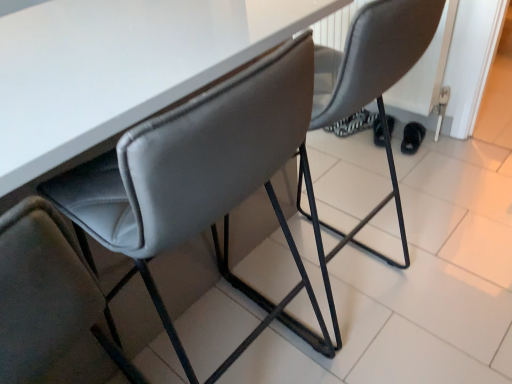
Where is `suede-like gray chair at center, which ranks as the 2th chair in right-to-left order`? suede-like gray chair at center, which ranks as the 2th chair in right-to-left order is located at coordinates (203, 182).

Between suede-like gray chair at center, which ranks as the 2th chair in right-to-left order, and black fuzzy slipper at lower right, which one has smaller size?

black fuzzy slipper at lower right is smaller.

Is suede-like gray chair at center, the 1th chair from the left, surrounding black fuzzy slipper at lower right?

No, black fuzzy slipper at lower right is located outside of suede-like gray chair at center, the 1th chair from the left.

From the image's perspective, is suede-like gray chair at center, the 1th chair from the left, on top of black fuzzy slipper at lower right?

Actually, suede-like gray chair at center, the 1th chair from the left, appears below black fuzzy slipper at lower right in the image.

Which is in front, suede-like gray chair at center, the 1th chair from the left, or black fuzzy slipper at lower right?

Positioned in front is suede-like gray chair at center, the 1th chair from the left.

From the image's perspective, is suede-like gray chair at center, which ranks as the 2th chair in right-to-left order, over matte gray chair at center, the 2th chair viewed from the left?

Indeed, from the image's perspective, suede-like gray chair at center, which ranks as the 2th chair in right-to-left order, is shown above matte gray chair at center, the 2th chair viewed from the left.

Is suede-like gray chair at center, which ranks as the 2th chair in right-to-left order, positioned with its back to matte gray chair at center, the first chair when ordered from right to left?

Yes, suede-like gray chair at center, which ranks as the 2th chair in right-to-left order, is positioned with its back facing matte gray chair at center, the first chair when ordered from right to left.

Which is correct: suede-like gray chair at center, the 1th chair from the left, is inside matte gray chair at center, the 2th chair viewed from the left, or outside of it?

suede-like gray chair at center, the 1th chair from the left, is spatially situated outside matte gray chair at center, the 2th chair viewed from the left.

Are suede-like gray chair at center, which ranks as the 2th chair in right-to-left order, and matte gray chair at center, the first chair when ordered from right to left, making contact?

No, suede-like gray chair at center, which ranks as the 2th chair in right-to-left order, is not touching matte gray chair at center, the first chair when ordered from right to left.

Between black fuzzy slipper at lower right and matte gray chair at center, the first chair when ordered from right to left, which one appears on the right side from the viewer's perspective?

From the viewer's perspective, black fuzzy slipper at lower right appears more on the right side.

Considering the sizes of black fuzzy slipper at lower right and matte gray chair at center, the 2th chair viewed from the left, in the image, is black fuzzy slipper at lower right wider or thinner than matte gray chair at center, the 2th chair viewed from the left,?

In the image, black fuzzy slipper at lower right appears to be more narrow than matte gray chair at center, the 2th chair viewed from the left.

Based on the photo, is black fuzzy slipper at lower right in contact with matte gray chair at center, the 2th chair viewed from the left?

No, black fuzzy slipper at lower right is not beside matte gray chair at center, the 2th chair viewed from the left.

Is black fuzzy slipper at lower right outside of matte gray chair at center, the first chair when ordered from right to left?

Yes, black fuzzy slipper at lower right is not within matte gray chair at center, the first chair when ordered from right to left.

Is matte gray chair at center, the first chair when ordered from right to left, touching black fuzzy slipper at lower right?

No, matte gray chair at center, the first chair when ordered from right to left, is not with black fuzzy slipper at lower right.

Does matte gray chair at center, the first chair when ordered from right to left, have a smaller size compared to black fuzzy slipper at lower right?

No.

Is matte gray chair at center, the 2th chair viewed from the left, at the left side of black fuzzy slipper at lower right?

Correct, you'll find matte gray chair at center, the 2th chair viewed from the left, to the left of black fuzzy slipper at lower right.

Considering the relative sizes of black fuzzy slipper at lower right and suede-like gray chair at center, which ranks as the 2th chair in right-to-left order, in the image provided, is black fuzzy slipper at lower right bigger than suede-like gray chair at center, which ranks as the 2th chair in right-to-left order,?

No.

Can you tell me how much black fuzzy slipper at lower right and suede-like gray chair at center, which ranks as the 2th chair in right-to-left order, differ in facing direction?

The angular difference between black fuzzy slipper at lower right and suede-like gray chair at center, which ranks as the 2th chair in right-to-left order, is 111 degrees.

Is black fuzzy slipper at lower right not near suede-like gray chair at center, the 1th chair from the left?

Yes, black fuzzy slipper at lower right and suede-like gray chair at center, the 1th chair from the left, are quite far apart.

From the image's perspective, which is below, black fuzzy slipper at lower right or suede-like gray chair at center, the 1th chair from the left?

suede-like gray chair at center, the 1th chair from the left, appears lower in the image.

Is matte gray chair at center, the first chair when ordered from right to left, at the left side of suede-like gray chair at center, the 1th chair from the left?

Incorrect, matte gray chair at center, the first chair when ordered from right to left, is not on the left side of suede-like gray chair at center, the 1th chair from the left.

Based on the photo, is matte gray chair at center, the 2th chair viewed from the left, far from suede-like gray chair at center, the 1th chair from the left?

No, there isn't a large distance between matte gray chair at center, the 2th chair viewed from the left, and suede-like gray chair at center, the 1th chair from the left.

Which is in front, matte gray chair at center, the first chair when ordered from right to left, or suede-like gray chair at center, which ranks as the 2th chair in right-to-left order?

suede-like gray chair at center, which ranks as the 2th chair in right-to-left order, is more forward.

From the black fuzzy slipper at lower right, count 2nd chairs forward and point to it. Please provide its 2D coordinates.

[(203, 182)]

Locate an element on the screen. chair above the suede-like gray chair at center, the 1th chair from the left (from a real-world perspective) is located at coordinates (371, 86).

Which object lies further to the anchor point matte gray chair at center, the 2th chair viewed from the left, black fuzzy slipper at lower right or suede-like gray chair at center, which ranks as the 2th chair in right-to-left order?

black fuzzy slipper at lower right.

From the picture: When comparing their distances from suede-like gray chair at center, which ranks as the 2th chair in right-to-left order, does black fuzzy slipper at lower right or matte gray chair at center, the 2th chair viewed from the left, seem further?

black fuzzy slipper at lower right is positioned further to the anchor suede-like gray chair at center, which ranks as the 2th chair in right-to-left order.

From the image, which object appears to be nearer to black fuzzy slipper at lower right, suede-like gray chair at center, which ranks as the 2th chair in right-to-left order, or matte gray chair at center, the 2th chair viewed from the left?

The object closer to black fuzzy slipper at lower right is matte gray chair at center, the 2th chair viewed from the left.

Which object lies further to the anchor point black fuzzy slipper at lower right, matte gray chair at center, the first chair when ordered from right to left, or suede-like gray chair at center, which ranks as the 2th chair in right-to-left order?

suede-like gray chair at center, which ranks as the 2th chair in right-to-left order, is further to black fuzzy slipper at lower right.

Based on their spatial positions, is suede-like gray chair at center, which ranks as the 2th chair in right-to-left order, or black fuzzy slipper at lower right closer to matte gray chair at center, the 2th chair viewed from the left?

suede-like gray chair at center, which ranks as the 2th chair in right-to-left order, is closer to matte gray chair at center, the 2th chair viewed from the left.

Estimate the real-world distances between objects in this image. Which object is further from suede-like gray chair at center, the 1th chair from the left, matte gray chair at center, the first chair when ordered from right to left, or black fuzzy slipper at lower right?

black fuzzy slipper at lower right is positioned further to the anchor suede-like gray chair at center, the 1th chair from the left.

This screenshot has height=384, width=512. I want to click on chair between suede-like gray chair at center, the 1th chair from the left, and black fuzzy slipper at lower right, along the z-axis, so click(371, 86).